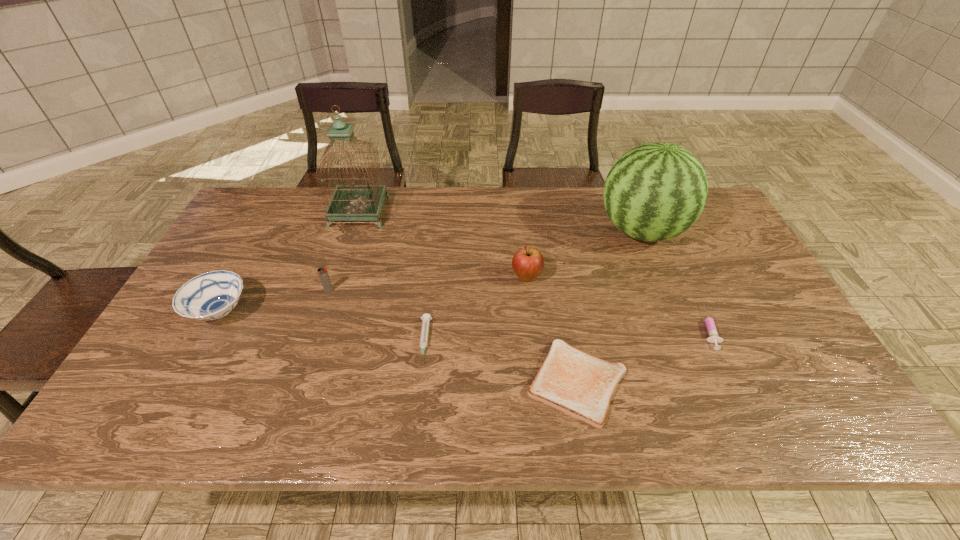
Where is `vacant space situated 0.100m on the back of the watermelon`? Image resolution: width=960 pixels, height=540 pixels. vacant space situated 0.100m on the back of the watermelon is located at coordinates (624, 187).

Find the location of a particular element. The height and width of the screenshot is (540, 960). free space located 0.090m on the left of the third farthest object is located at coordinates (479, 277).

Find the location of a particular element. The image size is (960, 540). vacant area situated 0.230m on the front of the igniter is located at coordinates (304, 365).

Find the location of a particular element. Image resolution: width=960 pixels, height=540 pixels. free spot located 0.330m on the right of the leftmost object is located at coordinates (377, 312).

You are a GUI agent. You are given a task and a screenshot of the screen. Output one action in this format:
    pyautogui.click(x=<x>, y=<y>)
    Task: Click on the free space located on the front of the right syringe
    This screenshot has width=960, height=540.
    Given the screenshot: What is the action you would take?
    pyautogui.click(x=729, y=376)

Where is `vacant region located 0.140m at the needle end of the fifth object from right to left`? vacant region located 0.140m at the needle end of the fifth object from right to left is located at coordinates (416, 422).

This screenshot has width=960, height=540. Identify the location of blank space located on the left of the shortest object. (360, 382).

I want to click on birdcage at the far edge, so click(352, 202).

At what (x,y) coordinates should I click in order to perform the action: click on watermelon that is at the far edge. Please return your answer as a coordinate pair (x, y). Image resolution: width=960 pixels, height=540 pixels. Looking at the image, I should click on pos(654,192).

This screenshot has width=960, height=540. What are the coordinates of `object present at the near edge` in the screenshot? It's located at (581, 385).